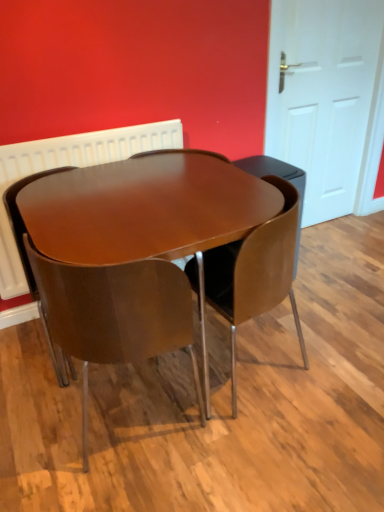
Identify the location of free spot to the right of brown leather chair at center, which is the 3th chair from left to right. (335, 346).